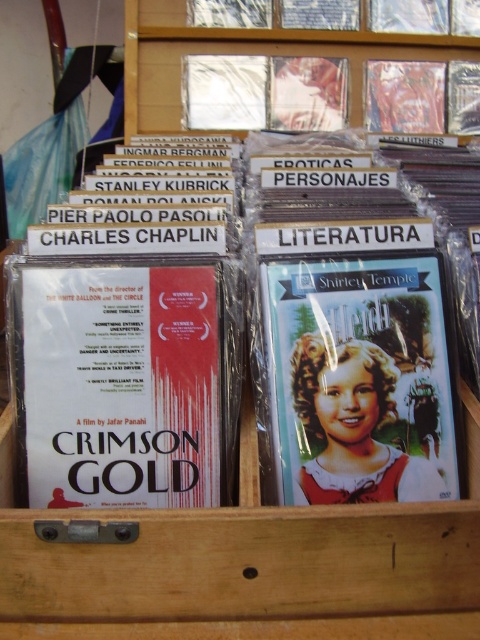
You are standing in front of a DVD shelf and want to reach a specific point on the shelf. The point is located at coordinates point (166, 288). If your arm can extend 30 inches, can you reach that point?

The distance between point (166, 288) and the viewer is 34.76 inches. Since your arm can only extend 30 inches, you cannot reach that point.

You are organizing DVDs on a shelf and have two items in front of you. One is a white matte DVD case at center and the other is a matte plastic DVD at center. Which item takes up more space on the shelf?

The matte plastic DVD at center takes up more space because the white matte DVD case at center occupies less space than it.